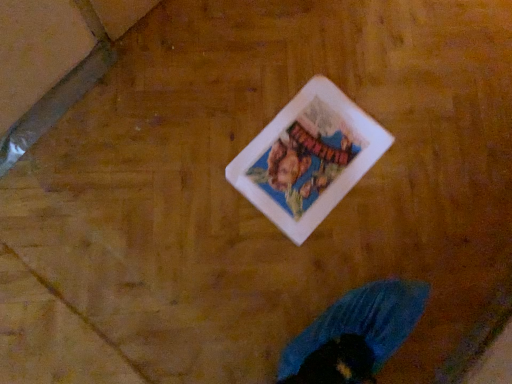
The width and height of the screenshot is (512, 384). Describe the element at coordinates (308, 158) in the screenshot. I see `white glossy comic book at center` at that location.

The height and width of the screenshot is (384, 512). Find the location of `white glossy comic book at center`. white glossy comic book at center is located at coordinates coord(308,158).

The width and height of the screenshot is (512, 384). What are the coordinates of `white glossy comic book at center` in the screenshot? It's located at click(x=308, y=158).